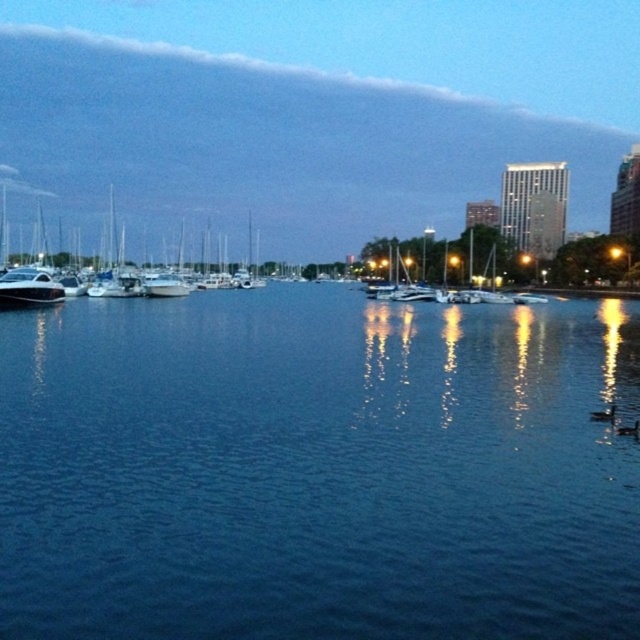
You are standing at the point marked by the coordinates in the image and want to know what is directly in front of you. What is the object located at the coordinates point [317,468]?

The point [317,468] marks blue water at center, so the object located there is blue water at center.

You are standing at the edge of the waterfront and notice the blue water at center and the shiny white sailboat at center. Which object is positioned closer to the left side of the scene?

The blue water at center is positioned to the left of the shiny white sailboat at center, so it is closer to the left side of the scene.